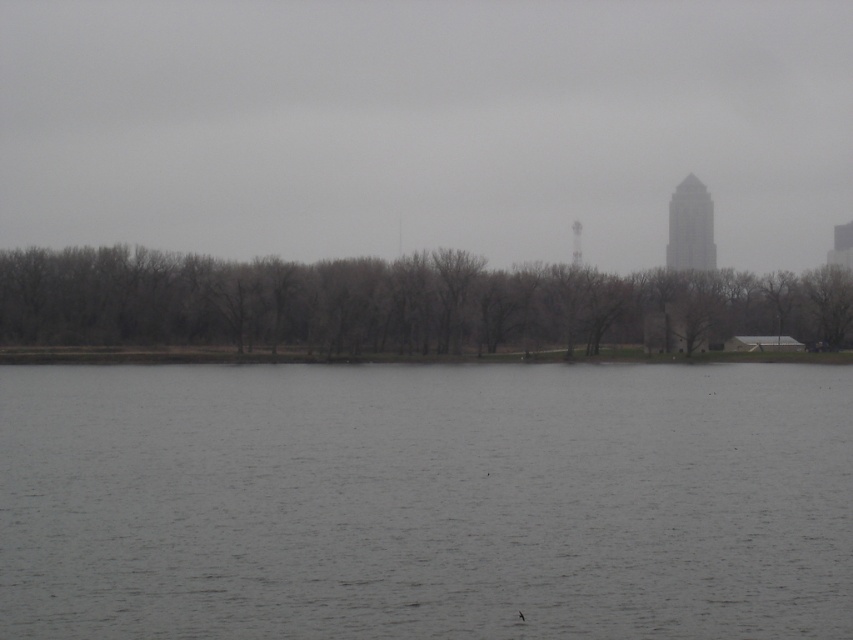
Can you confirm if gray water at center is positioned above brown/dry wood trees at center?

Incorrect, gray water at center is not positioned above brown/dry wood trees at center.

Is gray water at center closer to the viewer compared to brown/dry wood trees at center?

Yes, gray water at center is closer to the viewer.

Identify the location of gray water at center. The image size is (853, 640). (425, 500).

Locate an element on the screen. The image size is (853, 640). gray water at center is located at coordinates (425, 500).